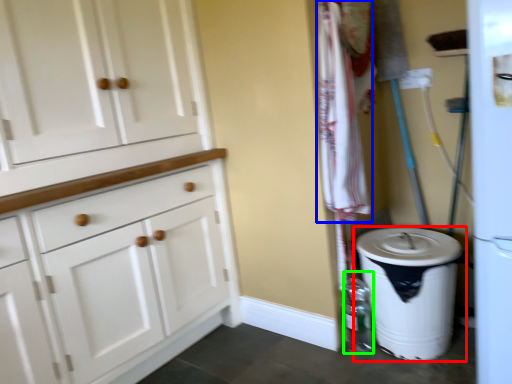
Question: Based on their relative distances, which object is farther from waste container (highlighted by a red box)? Choose from laundry (highlighted by a blue box) and bottle (highlighted by a green box).

Choices:
 (A) laundry
 (B) bottle

Answer: (A)